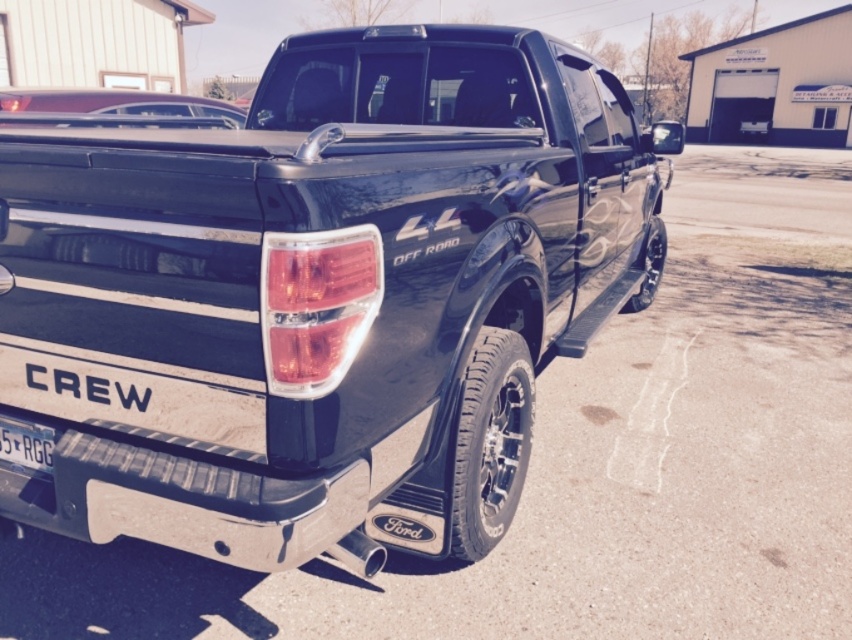
Question: Does glossy black truck at center have a lesser width compared to matte black license plate at lower left?

Choices:
 (A) no
 (B) yes

Answer: (A)

Question: Can you confirm if glossy black truck at center is positioned to the left of matte black license plate at lower left?

Choices:
 (A) no
 (B) yes

Answer: (A)

Question: Does glossy black truck at center appear over matte black license plate at lower left?

Choices:
 (A) no
 (B) yes

Answer: (B)

Question: Which point is closer to the camera?

Choices:
 (A) (177, 401)
 (B) (7, 420)

Answer: (A)

Question: Among these points, which one is farthest from the camera?

Choices:
 (A) (165, 262)
 (B) (36, 429)

Answer: (B)

Question: Which point is farther to the camera?

Choices:
 (A) (0, 440)
 (B) (52, 170)

Answer: (A)